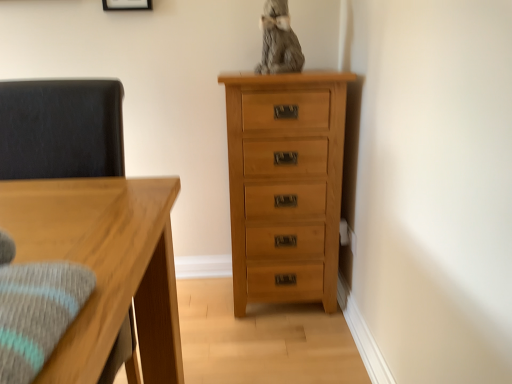
Locate an element on the screen. matte white picture frame at upper center is located at coordinates (127, 5).

Measure the distance between point (4, 142) and camera.

A distance of 1.13 meters exists between point (4, 142) and camera.

Locate an element on the screen. matte white picture frame at upper center is located at coordinates (127, 5).

Can matte white picture frame at upper center be found inside dark gray fabric swivel chair at left?

Definitely not — matte white picture frame at upper center is not inside dark gray fabric swivel chair at left.

Image resolution: width=512 pixels, height=384 pixels. What are the coordinates of `swivel chair on the left of matte white picture frame at upper center` in the screenshot? It's located at 61,129.

From a real-world perspective, which object stands above the other?

matte white picture frame at upper center, from a real-world perspective.

Measure the distance between dark gray fabric swivel chair at left and matte white picture frame at upper center.

dark gray fabric swivel chair at left is 35.13 inches away from matte white picture frame at upper center.

From a real-world perspective, is matte white picture frame at upper center positioned over natural wood chest of drawers at right based on gravity?

Yes, from a real-world perspective, matte white picture frame at upper center is on top of natural wood chest of drawers at right.

Considering the relative sizes of matte white picture frame at upper center and natural wood chest of drawers at right in the image provided, is matte white picture frame at upper center shorter than natural wood chest of drawers at right?

Yes.

Considering the positions of objects matte white picture frame at upper center and natural wood chest of drawers at right in the image provided, who is more to the right, matte white picture frame at upper center or natural wood chest of drawers at right?

natural wood chest of drawers at right.

How far apart are matte white picture frame at upper center and natural wood chest of drawers at right?

39.03 inches.

Can you confirm if dark gray fabric swivel chair at left is thinner than natural wood chest of drawers at right?

Yes, dark gray fabric swivel chair at left is thinner than natural wood chest of drawers at right.

From the image's perspective, is dark gray fabric swivel chair at left below natural wood chest of drawers at right?

Incorrect, from the image's perspective, dark gray fabric swivel chair at left is higher than natural wood chest of drawers at right.

Is natural wood chest of drawers at right at the back of dark gray fabric swivel chair at left?

No, dark gray fabric swivel chair at left is not facing the opposite direction of natural wood chest of drawers at right.

Between point (29, 89) and point (289, 250), which one is positioned in front?

The point (29, 89) is closer.

Between matte white picture frame at upper center and dark gray fabric swivel chair at left, which one has larger size?

Bigger between the two is dark gray fabric swivel chair at left.

From the image's perspective, is matte white picture frame at upper center beneath dark gray fabric swivel chair at left?

Actually, matte white picture frame at upper center appears above dark gray fabric swivel chair at left in the image.

Looking at their sizes, would you say matte white picture frame at upper center is wider or thinner than dark gray fabric swivel chair at left?

Considering their sizes, matte white picture frame at upper center looks slimmer than dark gray fabric swivel chair at left.

At what (x,y) coordinates should I click in order to perform the action: click on swivel chair in front of the matte white picture frame at upper center. Please return your answer as a coordinate pair (x, y). The width and height of the screenshot is (512, 384). Looking at the image, I should click on (61, 129).

Could you measure the distance between natural wood chest of drawers at right and dark gray fabric swivel chair at left?

natural wood chest of drawers at right is 27.18 inches from dark gray fabric swivel chair at left.

Looking at this image, who is more distant, natural wood chest of drawers at right or dark gray fabric swivel chair at left?

natural wood chest of drawers at right is more distant.

Is natural wood chest of drawers at right placed right next to dark gray fabric swivel chair at left?

No, natural wood chest of drawers at right is not in contact with dark gray fabric swivel chair at left.

Is natural wood chest of drawers at right at the right side of dark gray fabric swivel chair at left?

Indeed, natural wood chest of drawers at right is positioned on the right side of dark gray fabric swivel chair at left.

Is natural wood chest of drawers at right positioned in front of matte white picture frame at upper center?

Yes, it is.

Does natural wood chest of drawers at right appear on the left side of matte white picture frame at upper center?

In fact, natural wood chest of drawers at right is to the right of matte white picture frame at upper center.

Considering the positions of points (334, 159) and (115, 7), is point (334, 159) closer to camera compared to point (115, 7)?

Yes, point (334, 159) is in front of point (115, 7).

Is natural wood chest of drawers at right thinner than matte white picture frame at upper center?

No.

The height and width of the screenshot is (384, 512). Find the location of `picture frame positioned vertically above the dark gray fabric swivel chair at left (from a real-world perspective)`. picture frame positioned vertically above the dark gray fabric swivel chair at left (from a real-world perspective) is located at coordinates (127, 5).

Find the location of a particular element. The height and width of the screenshot is (384, 512). the chest of drawers that appears below the matte white picture frame at upper center (from a real-world perspective) is located at coordinates (285, 184).

Estimate the real-world distances between objects in this image. Which object is closer to dark gray fabric swivel chair at left, natural wood chest of drawers at right or matte white picture frame at upper center?

Based on the image, natural wood chest of drawers at right appears to be nearer to dark gray fabric swivel chair at left.

Which object lies further to the anchor point matte white picture frame at upper center, dark gray fabric swivel chair at left or natural wood chest of drawers at right?

Based on the image, natural wood chest of drawers at right appears to be further to matte white picture frame at upper center.

Based on their spatial positions, is matte white picture frame at upper center or dark gray fabric swivel chair at left closer to natural wood chest of drawers at right?

dark gray fabric swivel chair at left is positioned closer to the anchor natural wood chest of drawers at right.

When comparing their distances from matte white picture frame at upper center, does natural wood chest of drawers at right or dark gray fabric swivel chair at left seem further?

The object further to matte white picture frame at upper center is natural wood chest of drawers at right.

Estimate the real-world distances between objects in this image. Which object is further from natural wood chest of drawers at right, dark gray fabric swivel chair at left or matte white picture frame at upper center?

matte white picture frame at upper center is further to natural wood chest of drawers at right.

Looking at the image, which one is located closer to dark gray fabric swivel chair at left, matte white picture frame at upper center or natural wood chest of drawers at right?

Among the two, natural wood chest of drawers at right is located nearer to dark gray fabric swivel chair at left.

What are the coordinates of `swivel chair that lies between matte white picture frame at upper center and natural wood chest of drawers at right from top to bottom` in the screenshot? It's located at (61, 129).